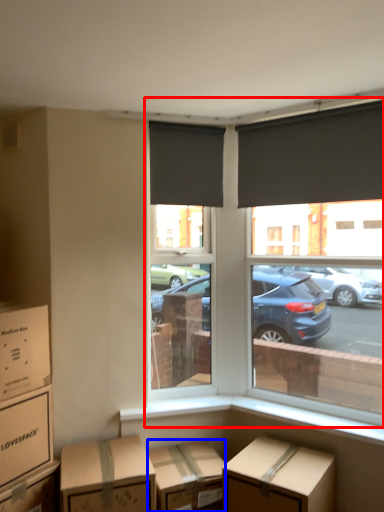
Question: Which object is further to the camera taking this photo, window (highlighted by a red box) or cardboard box (highlighted by a blue box)?

Choices:
 (A) window
 (B) cardboard box

Answer: (A)